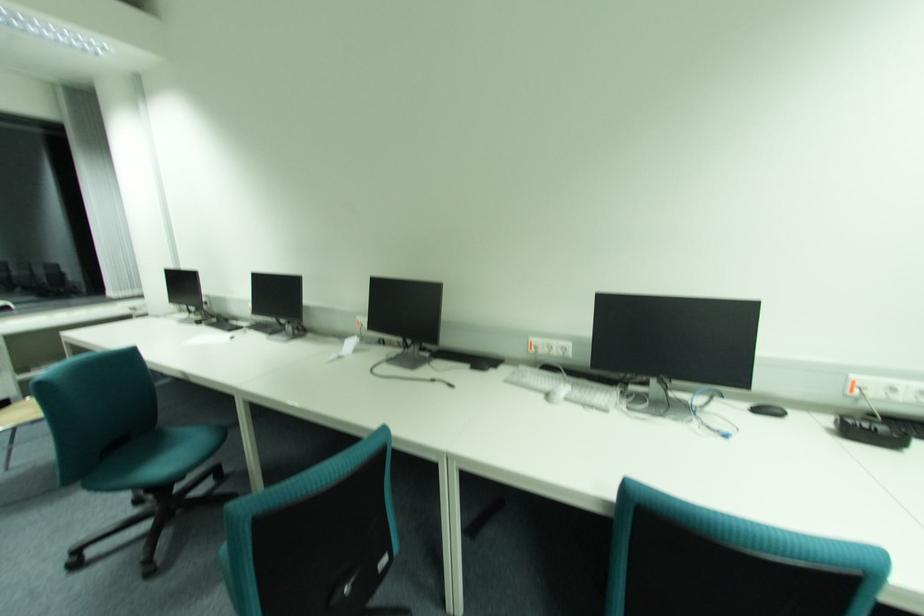
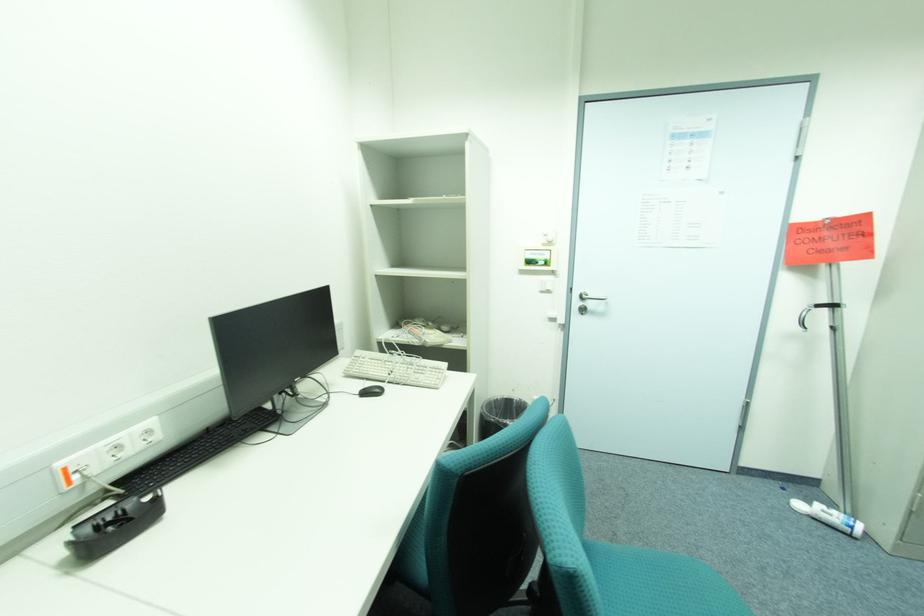
Question: The first image is from the beginning of the video and the second image is from the end. How did the camera likely rotate when shooting the video?

Choices:
 (A) Left
 (B) Right
 (C) Up
 (D) Down

Answer: (B)